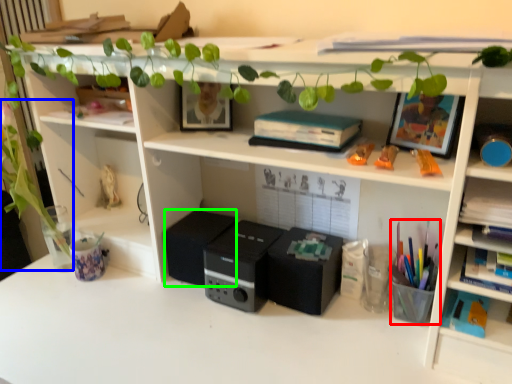
Question: Which object is the closest to the stationery (highlighted by a red box)? Choose among these: plant (highlighted by a blue box) or speaker (highlighted by a green box).

Choices:
 (A) plant
 (B) speaker

Answer: (B)